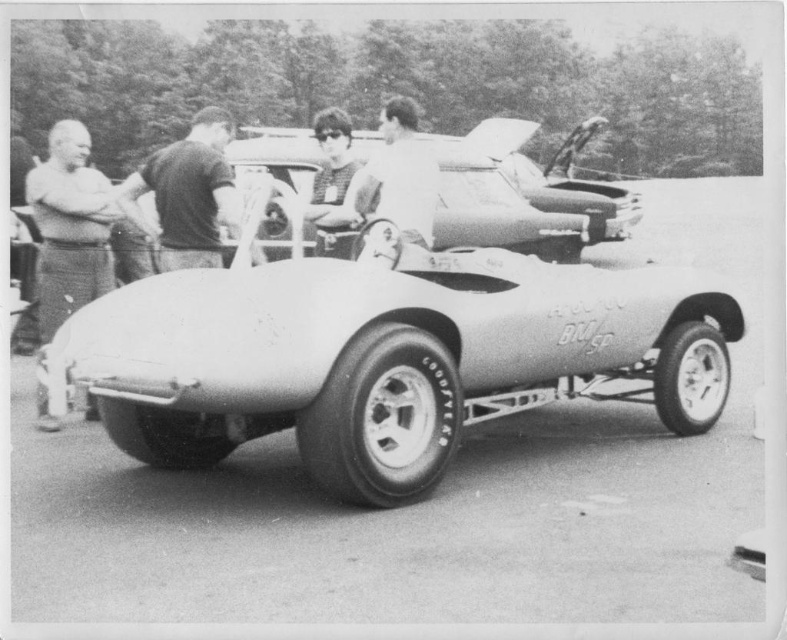
You are a photographer standing at the edge of the car event. You want to take a photo that includes both the shiny metallic car at center and the smooth leather jacket at center in the same frame. Given that your camera has a focal length of 50mm and a sensor size of 24x36mm, can you estimate whether the two objects can be captured in a single shot without moving the camera?

The distance between the shiny metallic car at center and the smooth leather jacket at center is 14.19 feet. With a 50mm lens on a full frame sensor, the field of view is approximately 46 degrees horizontally. Since both objects are at the center, they are within the same central area, so yes, they can be captured in a single shot without moving the camera.

In the scene shown: You are standing at the center of the image and want to take a photo of the shiny metallic car at center. In which direction should you move to get a better view of the car?

Since the shiny metallic car at center is already at the center of the image, you don not need to move to take a photo of it. You can simply aim your camera towards the car without changing your position.

You are a photographer standing at the edge of the car event. You want to capture a photo of both the metallic silver sports car at center and the dark gray shirt at center in the same frame. Based on their distance, will they both fit in your camera viewfinder that has a 3.5 meter field of view?

The metallic silver sports car at center is 2.76 meters from the dark gray shirt at center. Since the camera viewfinder has a 3.5 meter field of view, which is larger than the distance between them, both objects will fit in the same frame.